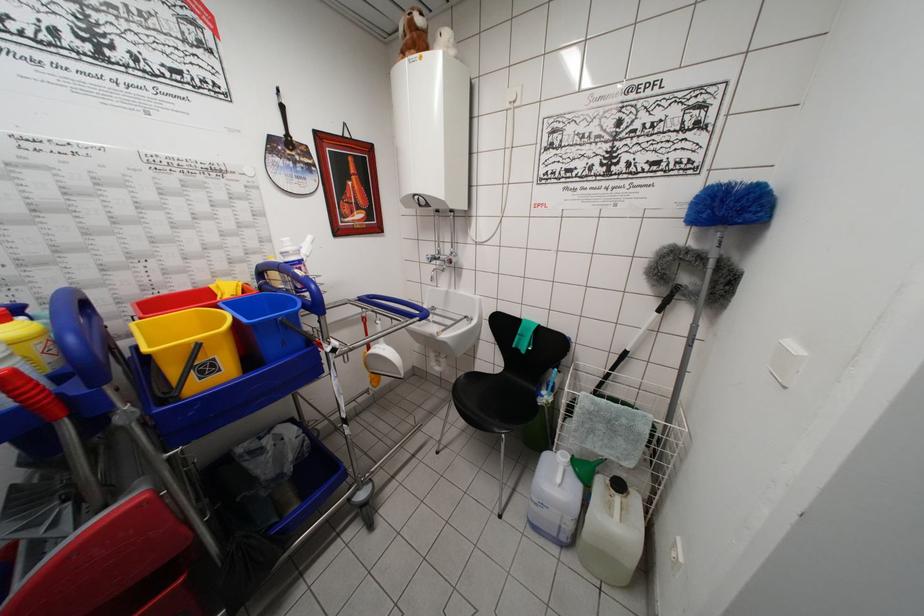
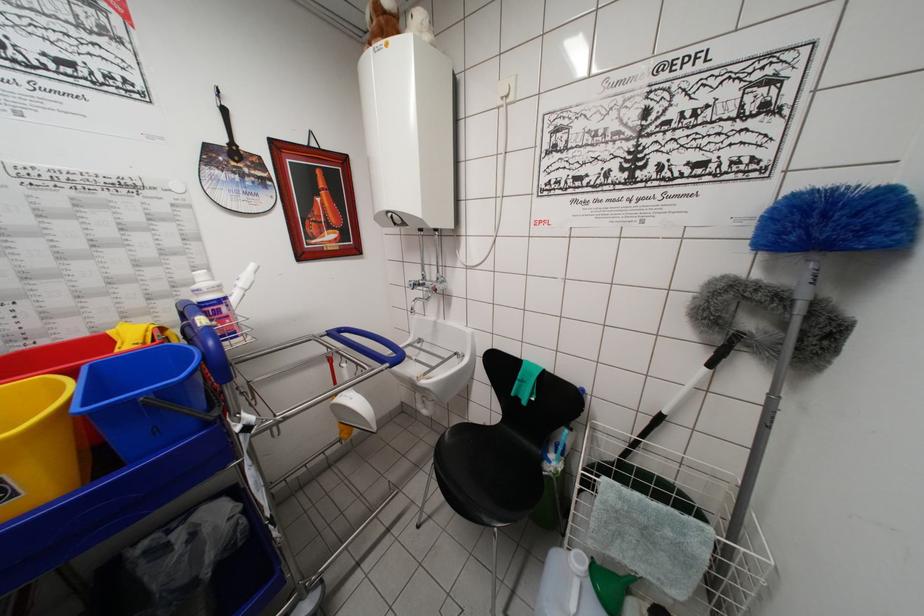
The point at (441, 338) is marked in the first image. Where is the corresponding point in the second image?

(420, 383)